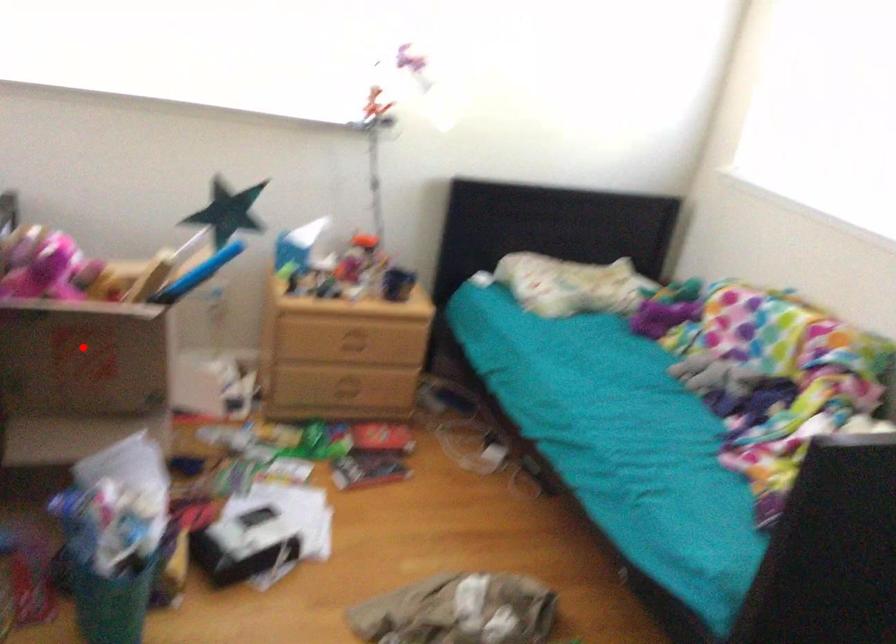
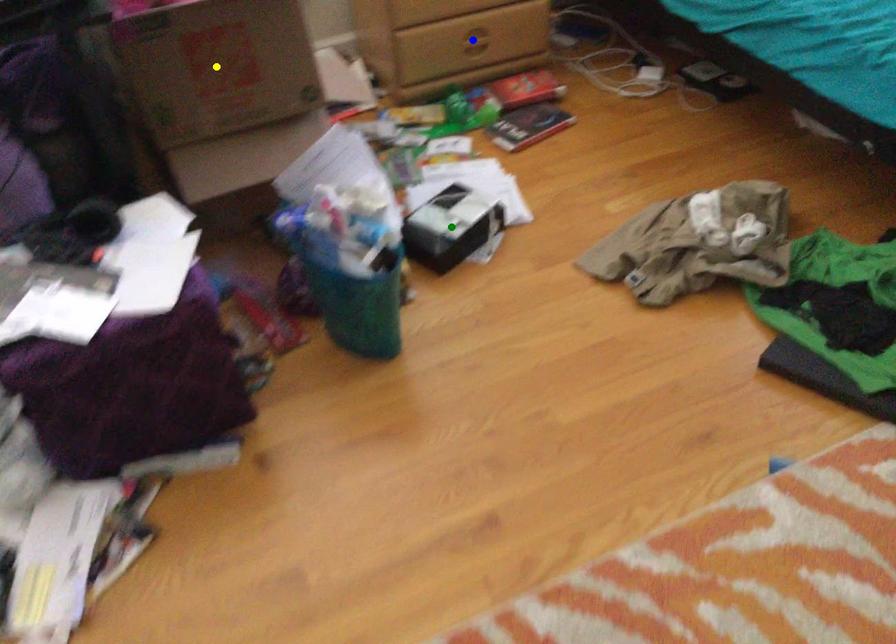
Question: I am providing you with two images of the same scene from different viewpoints. A red point is marked on the first image. You are given multiple points on the second image. Can you choose the point in image 2 that corresponds to the point in image 1?

Choices:
 (A) blue point
 (B) yellow point
 (C) green point

Answer: (B)